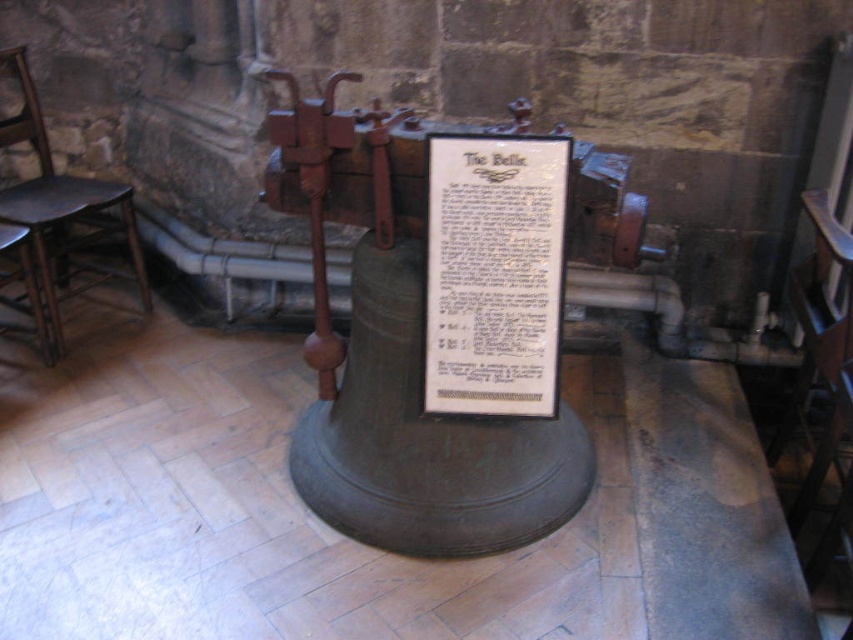
You are an interior designer planning to place a new decorative item between the white paper at center and the dark brown wooden chair at left. Considering their widths, which object should you place the item closer to?

The white paper at center has a smaller width than the dark brown wooden chair at left, so the decorative item should be placed closer to the white paper at center to maintain balance.

Based on the photo, you are standing in the historic building and want to read the text on the white paper at center. However, there is a dark brown wooden chair at left in the way. Can you move the chair to access the paper?

The white paper at center is in front of the dark brown wooden chair at left, meaning the chair is blocking your path to the paper. Moving the chair would allow you to access the paper.